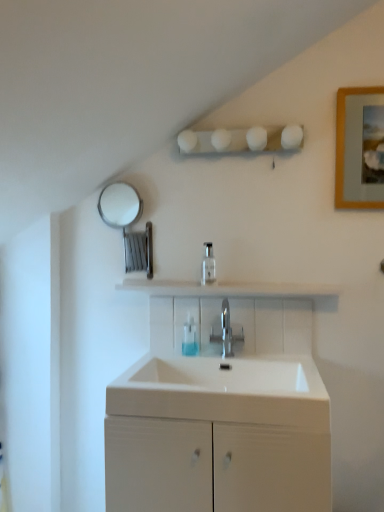
I want to click on vacant area situated below white glossy shelf at center (from a real-world perspective), so click(x=228, y=346).